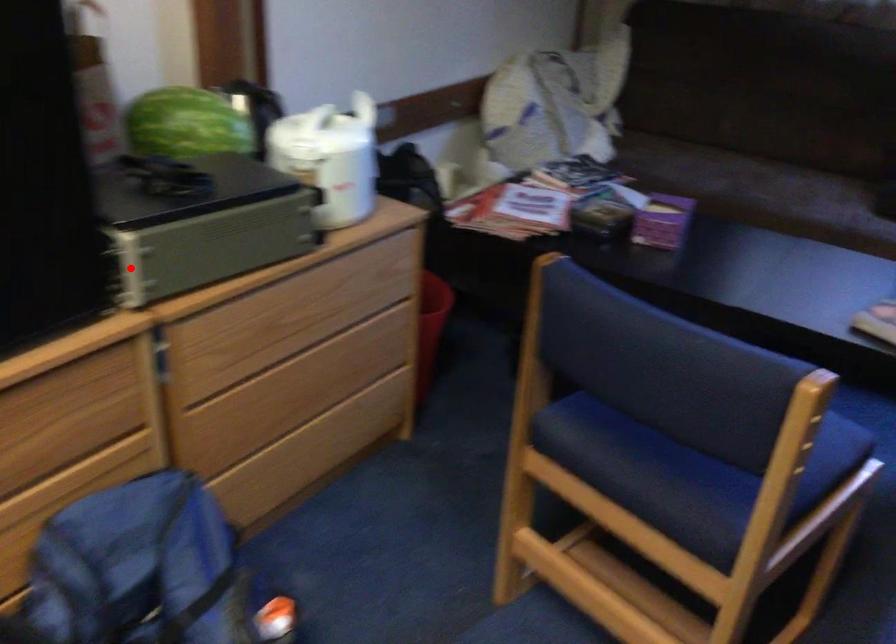
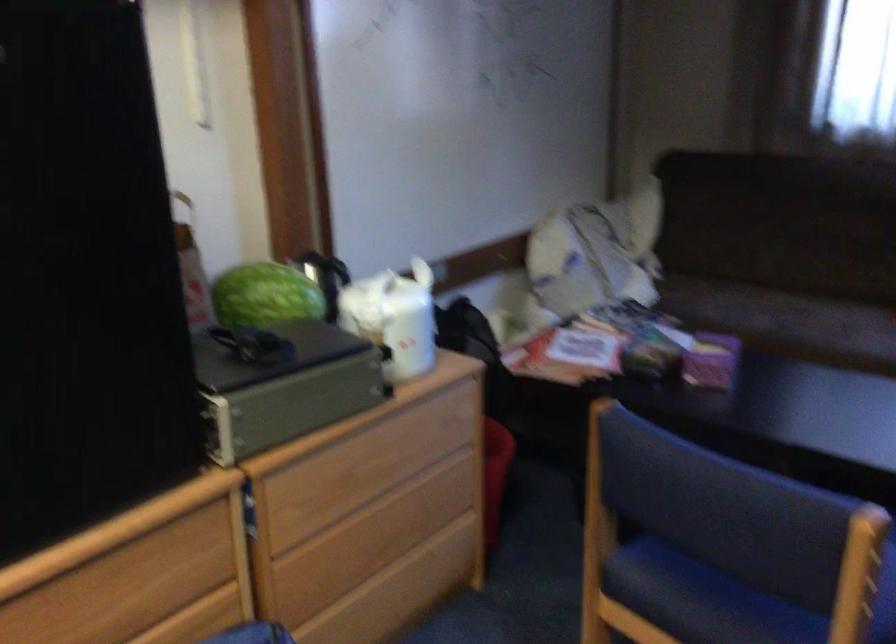
Question: I am providing you with two images of the same scene from different viewpoints. In image1, a red point is highlighted. Considering the same 3D point in image2, which of the following is correct?

Choices:
 (A) It is closer
 (B) It is farther

Answer: (B)